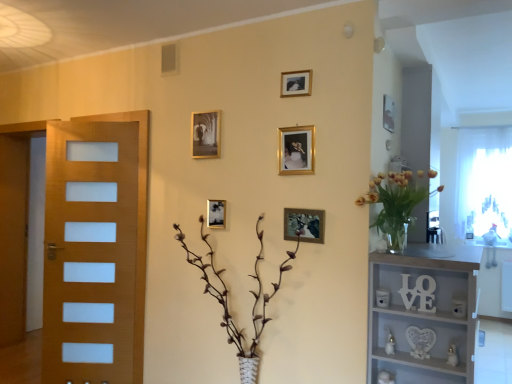
The image size is (512, 384). I want to click on gold metallic picture frame at upper center, which is the 3th picture frame in right-to-left order, so click(x=296, y=150).

Measure the distance between point (371,181) and camera.

The distance of point (371,181) from camera is 7.65 feet.

The image size is (512, 384). What do you see at coordinates (395, 204) in the screenshot?
I see `translucent glass vase at right` at bounding box center [395, 204].

In order to face metallic gold picture frame at center, arranged as the 5th picture frame when viewed from the right, should I rotate leftwards or rightwards?

To face it directly, rotate left by 5.433 degrees.

What do you see at coordinates (90, 252) in the screenshot? I see `wooden door at left` at bounding box center [90, 252].

Find the location of a particular element. The height and width of the screenshot is (384, 512). gold metallic picture frame at center, which appears as the second picture frame when viewed from the right is located at coordinates (304, 224).

Is point (397, 179) closer or farther from the camera than point (293, 91)?

Point (397, 179) appears to be closer to the viewer than point (293, 91).

Who is shorter, translucent glass vase at right or gold-framed photo at upper center, acting as the fourth picture frame starting from the right?

gold-framed photo at upper center, acting as the fourth picture frame starting from the right.

Between translucent glass vase at right and gold-framed photo at upper center, acting as the fourth picture frame starting from the right, which one is positioned in front?

translucent glass vase at right is in front.

Is translucent glass vase at right located outside gold-framed photo at upper center, acting as the fourth picture frame starting from the right?

Yes.

Looking at this image, which object is more forward, gold-framed photo at upper center, which is the 3th picture frame in left-to-right order, or wooden door at left?

gold-framed photo at upper center, which is the 3th picture frame in left-to-right order, is in front.

Does gold-framed photo at upper center, which is the 3th picture frame in left-to-right order, have a lesser height compared to wooden door at left?

Indeed, gold-framed photo at upper center, which is the 3th picture frame in left-to-right order, has a lesser height compared to wooden door at left.

Where is `door that is on the left side of gold-framed photo at upper center, acting as the fourth picture frame starting from the right`? This screenshot has height=384, width=512. door that is on the left side of gold-framed photo at upper center, acting as the fourth picture frame starting from the right is located at coordinates (90, 252).

From a real-world perspective, which picture frame is the 2nd one above the gold metallic picture frame at upper center, which is the sixth picture frame in right-to-left order? Please provide its 2D coordinates.

[(296, 83)]

Is gold-framed photo at upper center, which is the 3th picture frame in left-to-right order, positioned with its back to gold metallic picture frame at upper center, which is the 1th picture frame from left to right?

gold-framed photo at upper center, which is the 3th picture frame in left-to-right order, is not turned away from gold metallic picture frame at upper center, which is the 1th picture frame from left to right.

How different are the orientations of gold-framed photo at upper center, acting as the fourth picture frame starting from the right, and gold metallic picture frame at upper center, which is the sixth picture frame in right-to-left order, in degrees?

The facing directions of gold-framed photo at upper center, acting as the fourth picture frame starting from the right, and gold metallic picture frame at upper center, which is the sixth picture frame in right-to-left order, are 0.00166 degrees apart.

Is gold-framed photo at upper center, which is the 3th picture frame in left-to-right order, beside gold metallic picture frame at upper center, which is the 1th picture frame from left to right?

No, gold-framed photo at upper center, which is the 3th picture frame in left-to-right order, is not making contact with gold metallic picture frame at upper center, which is the 1th picture frame from left to right.

From a real-world perspective, which object rests below the other?

In real-world perspective, brown textured plant at center is lower.

In terms of width, does gold metallic picture frame at upper center, which ranks as the 1th picture frame in right-to-left order, look wider or thinner when compared to brown textured plant at center?

Clearly, gold metallic picture frame at upper center, which ranks as the 1th picture frame in right-to-left order, has less width compared to brown textured plant at center.

From the image's perspective, would you say gold metallic picture frame at upper center, which ranks as the 1th picture frame in right-to-left order, is positioned over brown textured plant at center?

Indeed, from the image's perspective, gold metallic picture frame at upper center, which ranks as the 1th picture frame in right-to-left order, is shown above brown textured plant at center.

Can you confirm if gold metallic picture frame at upper center, which is the 1th picture frame from left to right, is positioned to the left of translucent glass vase at right?

Yes, gold metallic picture frame at upper center, which is the 1th picture frame from left to right, is to the left of translucent glass vase at right.

From a real-world perspective, is gold metallic picture frame at upper center, which is the 1th picture frame from left to right, under translucent glass vase at right?

Actually, gold metallic picture frame at upper center, which is the 1th picture frame from left to right, is physically above translucent glass vase at right in the real world.

Is translucent glass vase at right at the back of gold metallic picture frame at upper center, which is the 1th picture frame from left to right?

No, gold metallic picture frame at upper center, which is the 1th picture frame from left to right, is not facing the opposite direction of translucent glass vase at right.

Is gold metallic picture frame at upper center, which is the 1th picture frame from left to right, located outside translucent glass vase at right?

That's correct, gold metallic picture frame at upper center, which is the 1th picture frame from left to right, is outside of translucent glass vase at right.

Does point (199, 155) come behind point (61, 161)?

No, (199, 155) is closer to viewer.

This screenshot has height=384, width=512. Identify the location of the 4th picture frame above the wooden door at left (from a real-world perspective). (x=206, y=134).

Considering the positions of objects gold metallic picture frame at upper center, which is the sixth picture frame in right-to-left order, and wooden door at left in the image provided, who is more to the left, gold metallic picture frame at upper center, which is the sixth picture frame in right-to-left order, or wooden door at left?

Positioned to the left is wooden door at left.

In the scene shown: Which object is more forward, gold metallic picture frame at upper center, which is the sixth picture frame in right-to-left order, or wooden door at left?

gold metallic picture frame at upper center, which is the sixth picture frame in right-to-left order.

Is metallic gold picture frame at center, arranged as the second picture frame when viewed from the left, looking in the opposite direction of translucent glass vase at right?

No, metallic gold picture frame at center, arranged as the second picture frame when viewed from the left, is not facing the opposite direction of translucent glass vase at right.

How distant is metallic gold picture frame at center, arranged as the second picture frame when viewed from the left, from translucent glass vase at right?

3.47 feet.

Is metallic gold picture frame at center, arranged as the second picture frame when viewed from the left, at the left side of translucent glass vase at right?

Yes, metallic gold picture frame at center, arranged as the second picture frame when viewed from the left, is to the left of translucent glass vase at right.

Is metallic gold picture frame at center, arranged as the 5th picture frame when viewed from the right, inside or outside of translucent glass vase at right?

metallic gold picture frame at center, arranged as the 5th picture frame when viewed from the right, is spatially situated outside translucent glass vase at right.

Where is `floral arrangement that is under the gold-framed photo at upper center, which is the 3th picture frame in left-to-right order (from a real-world perspective)`? floral arrangement that is under the gold-framed photo at upper center, which is the 3th picture frame in left-to-right order (from a real-world perspective) is located at coordinates (395, 204).

From the wooden door at left, count 4th picture frames forward and point to it. Please provide its 2D coordinates.

[(296, 83)]

Looking at the image, which one is located closer to white matte shelf at right, metallic gold picture frame at center, arranged as the 5th picture frame when viewed from the right, or brown textured plant at center?

brown textured plant at center lies closer to white matte shelf at right than the other object.

Consider the image. Looking at the image, which one is located closer to gold metallic picture frame at center, which is counted as the fifth picture frame, starting from the left, translucent glass vase at right or gold metallic picture frame at upper center, which ranks as the 1th picture frame in right-to-left order?

translucent glass vase at right.

Based on their spatial positions, is gold-framed photo at upper center, acting as the fourth picture frame starting from the right, or white matte shelf at right further from gold metallic picture frame at center, which is counted as the fifth picture frame, starting from the left?

gold-framed photo at upper center, acting as the fourth picture frame starting from the right, lies further to gold metallic picture frame at center, which is counted as the fifth picture frame, starting from the left, than the other object.

Based on their spatial positions, is gold metallic picture frame at upper center, which is the sixth picture frame in right-to-left order, or translucent glass vase at right further from white sheer curtain at right?

gold metallic picture frame at upper center, which is the sixth picture frame in right-to-left order, is further to white sheer curtain at right.

Which object lies nearer to the anchor point metallic gold picture frame at center, arranged as the second picture frame when viewed from the left, gold metallic picture frame at upper center, which is the 1th picture frame from left to right, or wooden door at left?

gold metallic picture frame at upper center, which is the 1th picture frame from left to right, is positioned closer to the anchor metallic gold picture frame at center, arranged as the second picture frame when viewed from the left.

Considering their positions, is gold-framed photo at upper center, acting as the fourth picture frame starting from the right, positioned further to brown textured plant at center than metallic gold picture frame at center, arranged as the 5th picture frame when viewed from the right?

gold-framed photo at upper center, acting as the fourth picture frame starting from the right, is further to brown textured plant at center.

When comparing their distances from gold metallic picture frame at upper center, arranged as the sixth picture frame when viewed from the left, does metallic gold picture frame at center, arranged as the second picture frame when viewed from the left, or white matte shelf at right seem closer?

white matte shelf at right is positioned closer to the anchor gold metallic picture frame at upper center, arranged as the sixth picture frame when viewed from the left.

Based on their spatial positions, is gold-framed photo at upper center, acting as the fourth picture frame starting from the right, or white sheer curtain at right closer to brown textured plant at center?

Among the two, gold-framed photo at upper center, acting as the fourth picture frame starting from the right, is located nearer to brown textured plant at center.

Where is `houseplant between gold metallic picture frame at upper center, which ranks as the 1th picture frame in right-to-left order, and white matte shelf at right in the up-down direction`? The width and height of the screenshot is (512, 384). houseplant between gold metallic picture frame at upper center, which ranks as the 1th picture frame in right-to-left order, and white matte shelf at right in the up-down direction is located at coordinates (227, 300).

Image resolution: width=512 pixels, height=384 pixels. Identify the location of shelf situated between wooden door at left and white sheer curtain at right from left to right. (423, 312).

The height and width of the screenshot is (384, 512). In order to click on houseplant situated between wooden door at left and gold metallic picture frame at upper center, arranged as the sixth picture frame when viewed from the left, from left to right in this screenshot , I will do `click(227, 300)`.

Where is `floral arrangement between brown textured plant at center and white sheer curtain at right from front to back`? floral arrangement between brown textured plant at center and white sheer curtain at right from front to back is located at coordinates (395, 204).